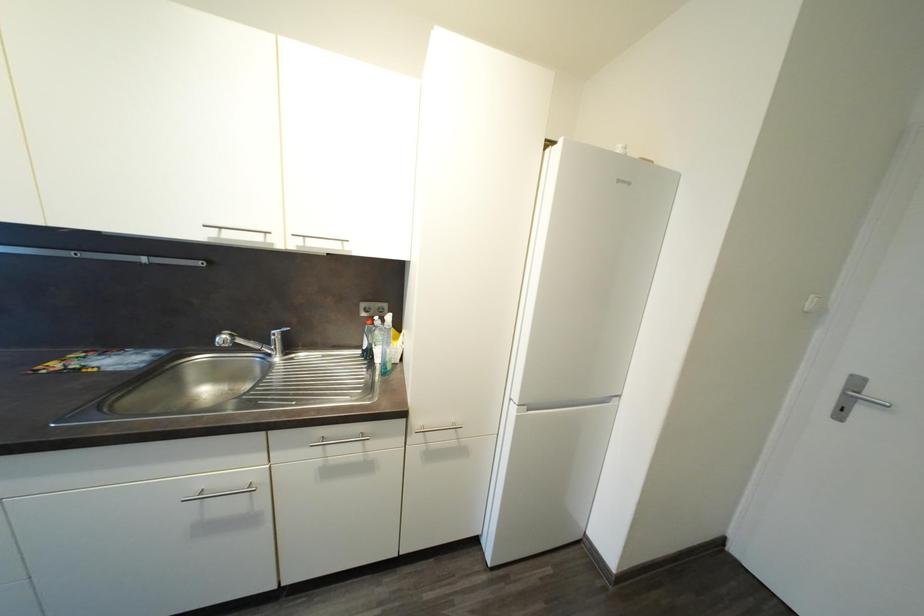
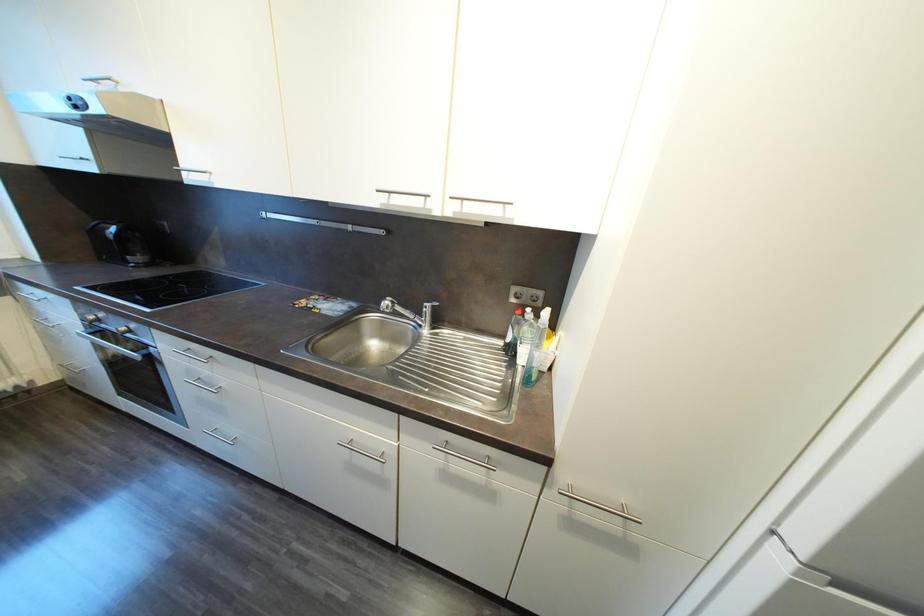
Question: The first image is from the beginning of the video and the second image is from the end. How did the camera likely rotate when shooting the video?

Choices:
 (A) Left
 (B) Right
 (C) Up
 (D) Down

Answer: (A)